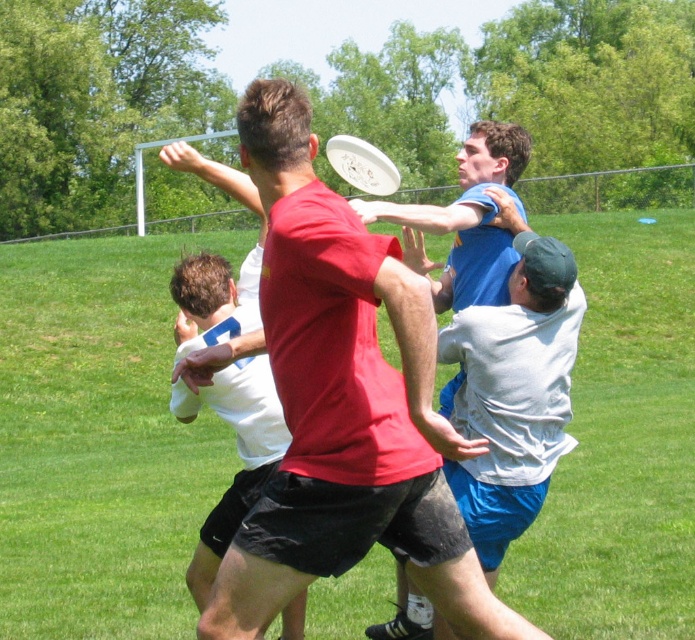
Question: Estimate the real-world distances between objects in this image. Which object is farther from the blue jersey at center?

Choices:
 (A) green grass at center
 (B) white matte jersey at center
 (C) white plastic frisbee at center

Answer: (A)

Question: Where is green grass at center located in relation to white matte jersey at center in the image?

Choices:
 (A) right
 (B) left

Answer: (B)

Question: Estimate the real-world distances between objects in this image. Which object is closer to the white matte jersey at center?

Choices:
 (A) green grass at center
 (B) white plastic frisbee at center
 (C) blue jersey at center

Answer: (C)

Question: Which of these objects is positioned farthest from the white matte jersey at center?

Choices:
 (A) blue jersey at center
 (B) green grass at center

Answer: (B)

Question: Does blue jersey at center have a larger size compared to white plastic frisbee at center?

Choices:
 (A) no
 (B) yes

Answer: (A)

Question: Can you confirm if blue jersey at center is thinner than white plastic frisbee at center?

Choices:
 (A) yes
 (B) no

Answer: (A)